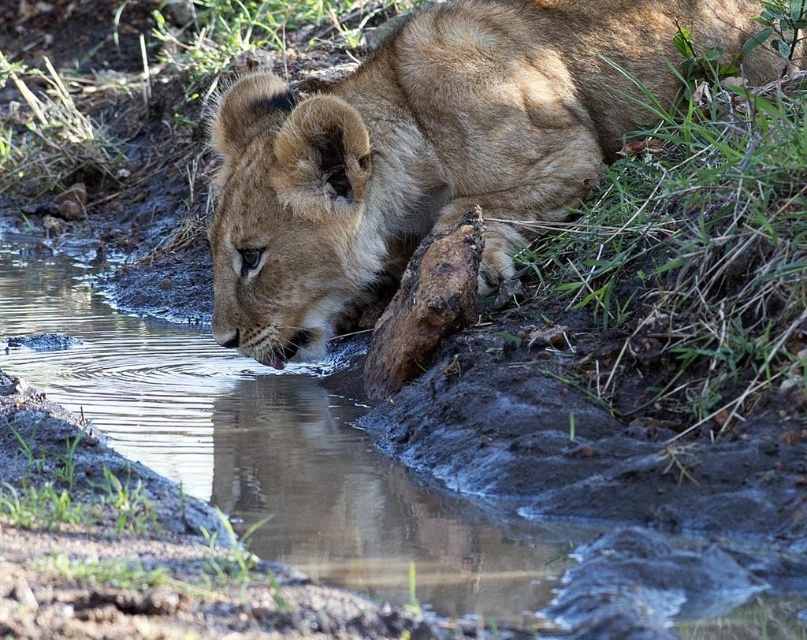
Which is in front, point (254, 282) or point (438, 557)?

Positioned in front is point (438, 557).

Does golden fur lion at center come behind brown muddy stream at lower left?

Yes, golden fur lion at center is behind brown muddy stream at lower left.

Which is behind, point (680, 4) or point (11, 284)?

The point (11, 284) is behind.

I want to click on golden fur lion at center, so click(429, 150).